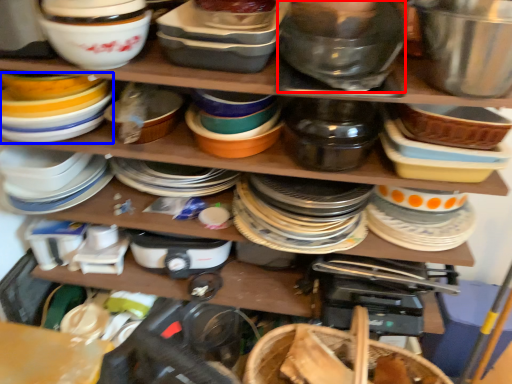
Question: Which object is further to the camera taking this photo, bowl (highlighted by a red box) or appliance (highlighted by a blue box)?

Choices:
 (A) bowl
 (B) appliance

Answer: (B)